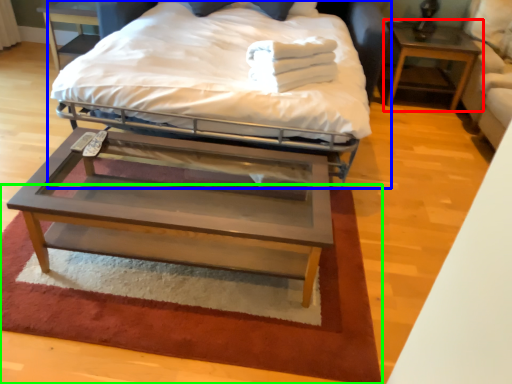
Question: Which is farther away from nightstand (highlighted by a red box)? bed (highlighted by a blue box) or mat (highlighted by a green box)?

Choices:
 (A) bed
 (B) mat

Answer: (B)